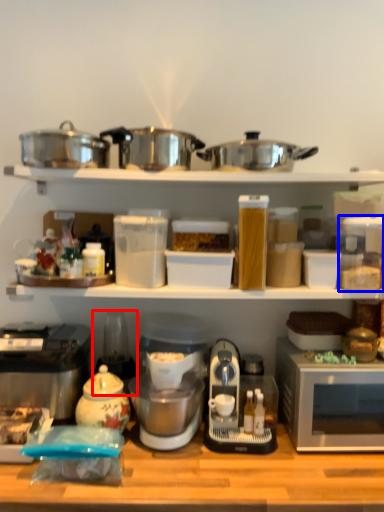
Question: Which object appears farthest to the camera in this image, appliance (highlighted by a red box) or appliance (highlighted by a blue box)?

Choices:
 (A) appliance
 (B) appliance

Answer: (A)